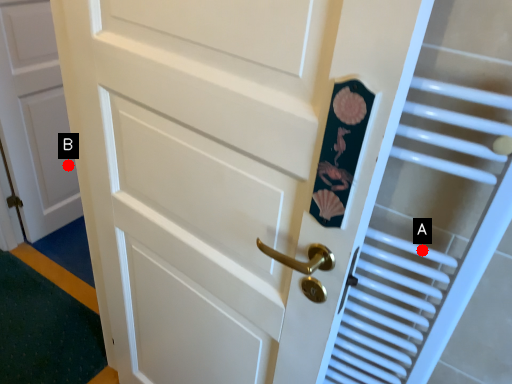
Question: Two points are circled on the image, labeled by A and B beside each circle. Which point is closer to the camera?

Choices:
 (A) A is closer
 (B) B is closer

Answer: (A)